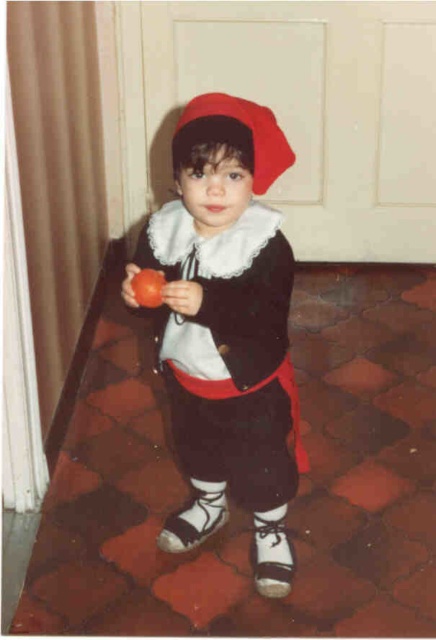
Who is more distant from viewer, (179, 289) or (128, 268)?

The point (128, 268) is behind.

Identify the location of matte red apple at center. (183, 296).

Describe the element at coordinates (230, 330) in the screenshot. I see `matte black outfit at center` at that location.

Does matte black outfit at center have a larger size compared to red felt hat at center?

Yes, matte black outfit at center is bigger than red felt hat at center.

Locate an element on the screen. matte black outfit at center is located at coordinates (230, 330).

How much distance is there between matte black outfit at center and matte orange apple at center?

15.74 inches

This screenshot has height=640, width=436. I want to click on matte black outfit at center, so click(230, 330).

Who is more forward, (296, 435) or (128, 273)?

Point (128, 273)

Identify the location of matte black outfit at center. This screenshot has height=640, width=436. [230, 330].